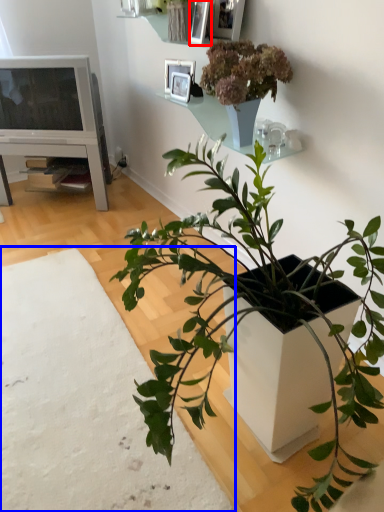
Question: Which point is further to the camera, picture frame (highlighted by a red box) or plain (highlighted by a blue box)?

Choices:
 (A) picture frame
 (B) plain

Answer: (A)